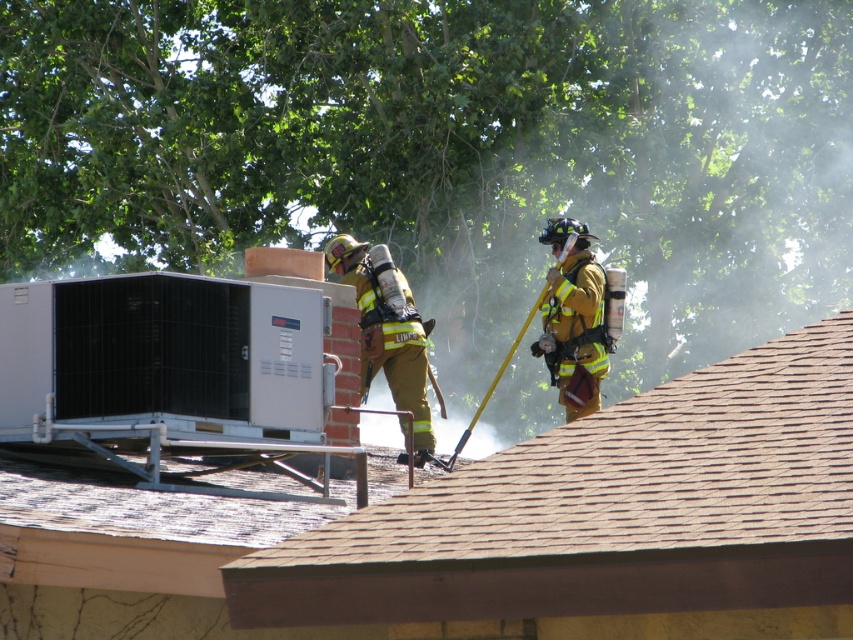
In the scene shown: Is brown shingles at upper center below reflective gold helmet at upper right?

Correct, brown shingles at upper center is located below reflective gold helmet at upper right.

Who is more distant from viewer, [704,513] or [572,412]?

The point [572,412] is behind.

Which is in front, point (399, 561) or point (583, 413)?

Point (399, 561) is more forward.

Identify the location of brown shingles at upper center. The image size is (853, 640). tap(605, 513).

Which is behind, point (830, 465) or point (428, 436)?

Point (428, 436)

You are a GUI agent. You are given a task and a screenshot of the screen. Output one action in this format:
    pyautogui.click(x=<x>, y=<y>)
    Task: Click on the brown shingles at upper center
    This screenshot has height=640, width=853.
    Given the screenshot: What is the action you would take?
    pyautogui.click(x=605, y=513)

Does point (753, 525) come in front of point (405, 296)?

That is True.

Identify the location of brown shingles at upper center. This screenshot has height=640, width=853. (605, 513).

Is point (404, 307) positioned before point (583, 348)?

Yes.

Does point (383, 285) come behind point (566, 406)?

No.

Identify the location of firefighter yellow uniform at center. The width and height of the screenshot is (853, 640). (387, 332).